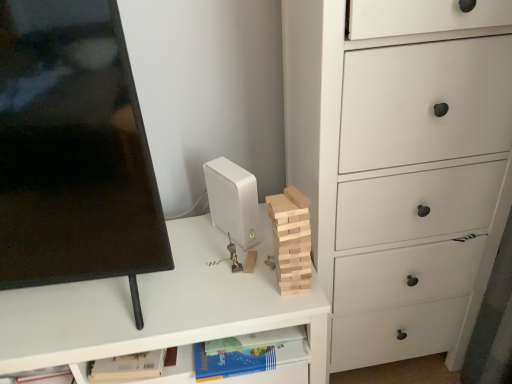
Question: From a real-world perspective, is white matte chest of drawers at right physically above natural wood block at center?

Choices:
 (A) yes
 (B) no

Answer: (B)

Question: Is white matte chest of drawers at right in contact with natural wood block at center?

Choices:
 (A) yes
 (B) no

Answer: (B)

Question: Does white matte chest of drawers at right have a lesser height compared to natural wood block at center?

Choices:
 (A) no
 (B) yes

Answer: (A)

Question: Would you say natural wood block at center is part of white matte chest of drawers at right's contents?

Choices:
 (A) yes
 (B) no

Answer: (B)

Question: Is natural wood block at center at the back of white matte chest of drawers at right?

Choices:
 (A) yes
 (B) no

Answer: (B)

Question: Considering the relative sizes of white matte chest of drawers at right and natural wood block at center in the image provided, is white matte chest of drawers at right thinner than natural wood block at center?

Choices:
 (A) no
 (B) yes

Answer: (A)

Question: Does white matte desk at center lie behind natural wood block at center?

Choices:
 (A) yes
 (B) no

Answer: (A)

Question: Could you tell me if white matte desk at center is turned towards natural wood block at center?

Choices:
 (A) yes
 (B) no

Answer: (B)

Question: Is white matte desk at center to the left of natural wood block at center from the viewer's perspective?

Choices:
 (A) yes
 (B) no

Answer: (A)

Question: Can you confirm if white matte desk at center is smaller than natural wood block at center?

Choices:
 (A) yes
 (B) no

Answer: (B)

Question: From the image's perspective, would you say white matte desk at center is shown under natural wood block at center?

Choices:
 (A) yes
 (B) no

Answer: (A)

Question: Would you say natural wood block at center is part of white matte desk at center's contents?

Choices:
 (A) no
 (B) yes

Answer: (A)

Question: Does white matte desktop computer at center appear on the left side of white matte chest of drawers at right?

Choices:
 (A) yes
 (B) no

Answer: (A)